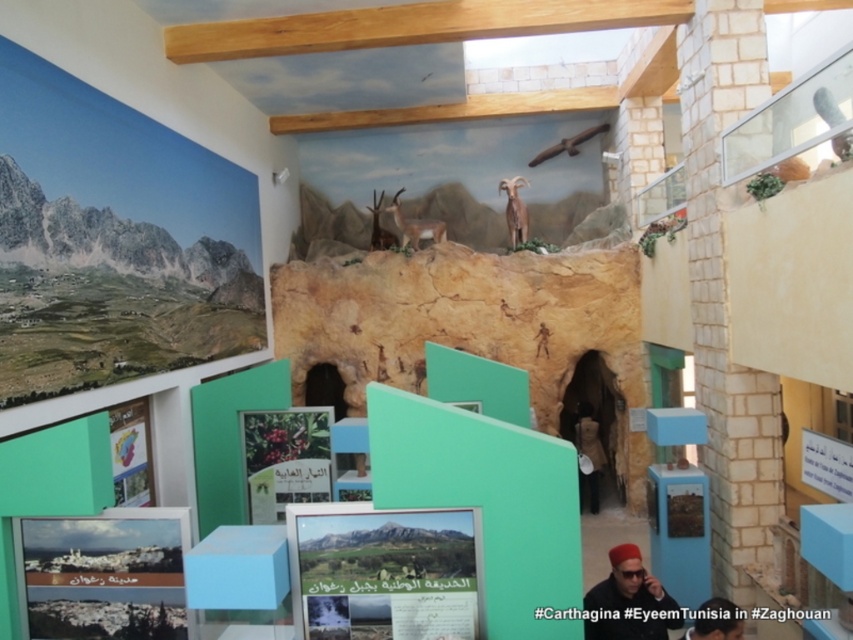
Question: Which point is farther to the camera?

Choices:
 (A) (845, 131)
 (B) (724, 634)

Answer: (A)

Question: Does matte red hat at lower right have a greater width compared to shiny brown horn at upper center?

Choices:
 (A) no
 (B) yes

Answer: (A)

Question: Can you confirm if matte red hat at lower right is wider than brown textured antelope at center?

Choices:
 (A) no
 (B) yes

Answer: (B)

Question: Estimate the real-world distances between objects in this image. Which object is closer to the brown matte goat at center?

Choices:
 (A) brown textured antelope at center
 (B) matte black hat at lower right
 (C) shiny brown ram at upper center
 (D) shiny brown horn at upper center

Answer: (A)

Question: Observing the image, what is the correct spatial positioning of matte black hat at lower right in reference to metallic silver knife at upper right?

Choices:
 (A) right
 (B) left

Answer: (B)

Question: Which point is farther to the camera?

Choices:
 (A) metallic silver knife at upper right
 (B) brown matte goat at center
 (C) matte black hat at lower right

Answer: (B)